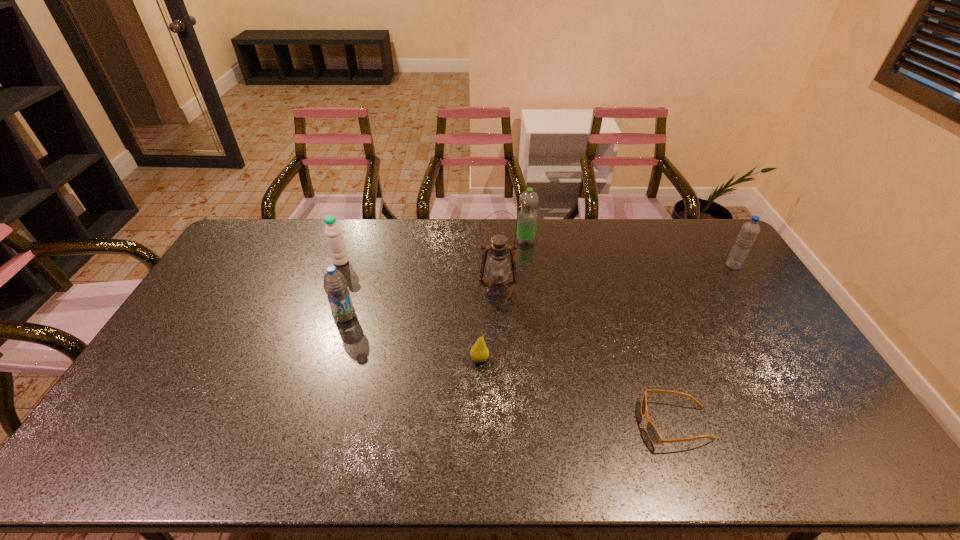
The width and height of the screenshot is (960, 540). Identify the location of the second object from right to left. (653, 434).

Image resolution: width=960 pixels, height=540 pixels. In order to click on the nearest object in this screenshot , I will do `click(653, 434)`.

Where is `vacant space located 0.140m on the back of the fourth nearest object`? The width and height of the screenshot is (960, 540). vacant space located 0.140m on the back of the fourth nearest object is located at coordinates coord(496,258).

At what (x,y) coordinates should I click in order to perform the action: click on vacant area situated 0.240m on the left of the third water bottle from left to right. Please return your answer as a coordinate pair (x, y). The height and width of the screenshot is (540, 960). Looking at the image, I should click on (454, 241).

You are a GUI agent. You are given a task and a screenshot of the screen. Output one action in this format:
    pyautogui.click(x=<x>, y=<y>)
    Task: Click on the vacant area situated on the front of the rightmost object
    The height and width of the screenshot is (540, 960).
    Given the screenshot: What is the action you would take?
    click(x=780, y=338)

This screenshot has width=960, height=540. I want to click on vacant area situated on the left of the sixth object from right to left, so click(236, 316).

Locate an element on the screen. The image size is (960, 540). blank area located 0.140m on the front of the leftmost object is located at coordinates (329, 294).

This screenshot has height=540, width=960. Identify the location of vacant space situated 0.060m on the back of the second nearest object. (480, 336).

The image size is (960, 540). Identify the location of vacant space located 0.090m on the front-facing side of the sunglasses. (608, 424).

You are a GUI agent. You are given a task and a screenshot of the screen. Output one action in this format:
    pyautogui.click(x=<x>, y=<y>)
    Task: Click on the vacant space located on the front-facing side of the sunglasses
    
    Given the screenshot: What is the action you would take?
    pyautogui.click(x=510, y=424)